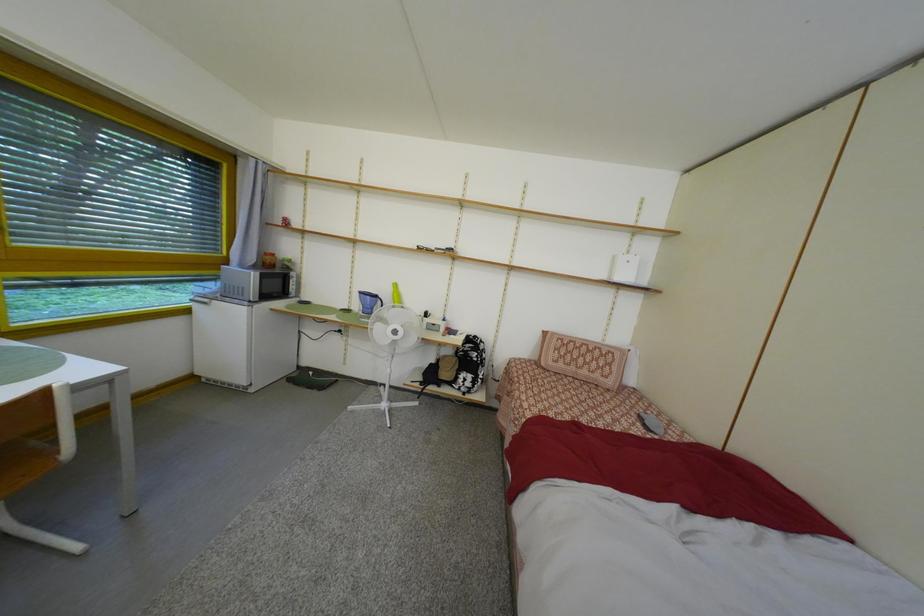
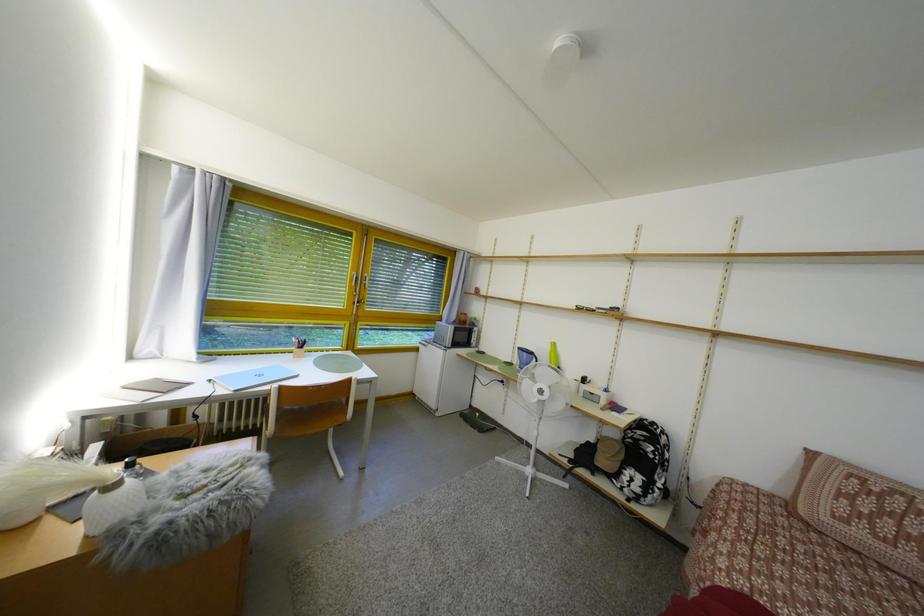
Question: The images are taken continuously from a first-person perspective. In which direction is your viewpoint rotating?

Choices:
 (A) Left
 (B) Right
 (C) Up
 (D) Down

Answer: (A)